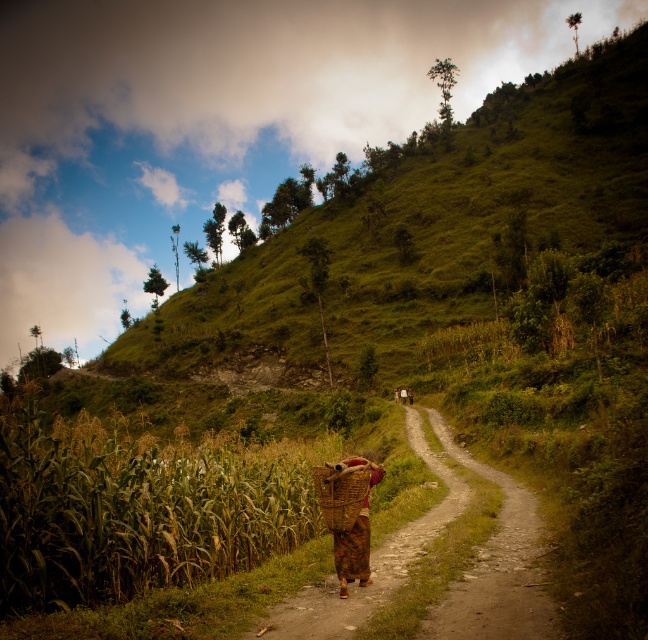
You are a hiker walking along the brown dirt path at center in the rural scene. You want to reach the green leafy corn at lower left to take a closer look. Which direction should you walk relative to the path?

The green leafy corn at lower left is to the left of the brown dirt path at center. To reach it, you should walk towards the left side of the path.

You are standing on the dirt path in the rural scene. You see the green leafy corn at lower left and the brown woven basket at center. Which object is closer to you?

The green leafy corn at lower left is closer to you because it is further to the viewer than the brown woven basket at center.

You are a hiker standing at the starting point of the dirt path. You notice the green leafy corn at lower left and the brown dirt path at center. Which object is closer to you?

The green leafy corn at lower left is closer to you since it is further to the viewer than the brown dirt path at center.